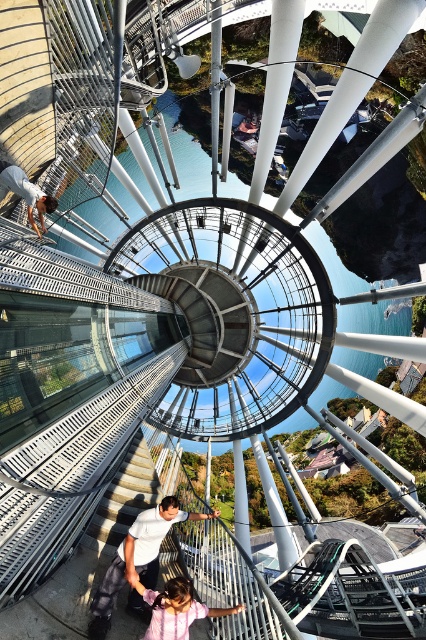
Describe the element at coordinates (137, 563) in the screenshot. This screenshot has width=426, height=640. I see `white matte shirt at center` at that location.

Identify the location of white matte shirt at center. The image size is (426, 640). pos(137,563).

Locate an element on the screen. white matte shirt at center is located at coordinates click(137, 563).

Does white matte shirt at center appear on the left side of matte white shirt at lower left?

No, white matte shirt at center is not to the left of matte white shirt at lower left.

Identify the location of white matte shirt at center. (137, 563).

Between metallic gray staircase at center and pink matte dress at lower center, which one is positioned higher?

metallic gray staircase at center

Does metallic gray staircase at center appear on the right side of pink matte dress at lower center?

In fact, metallic gray staircase at center is to the left of pink matte dress at lower center.

The width and height of the screenshot is (426, 640). Find the location of `metallic gray staircase at center`. metallic gray staircase at center is located at coordinates (123, 499).

I want to click on metallic gray staircase at center, so click(x=123, y=499).